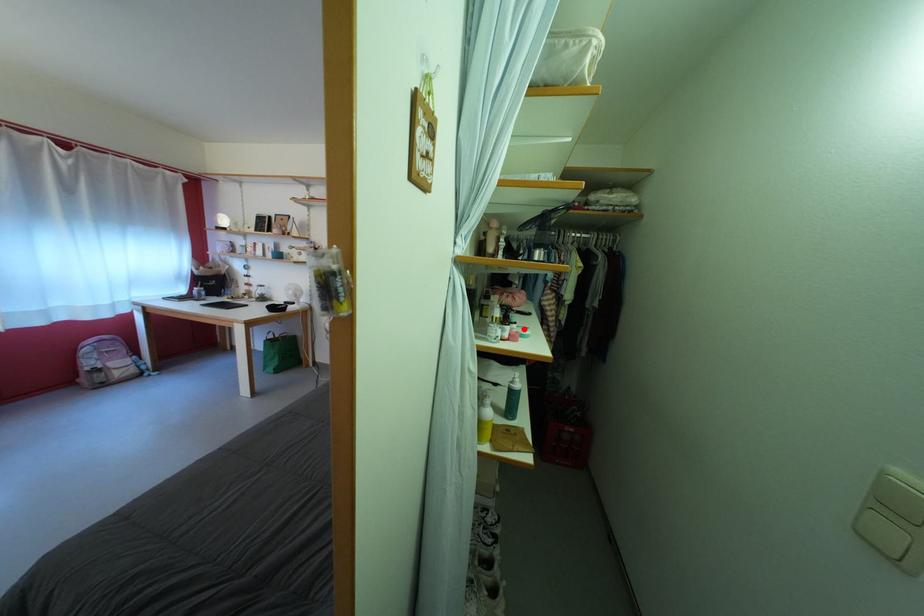
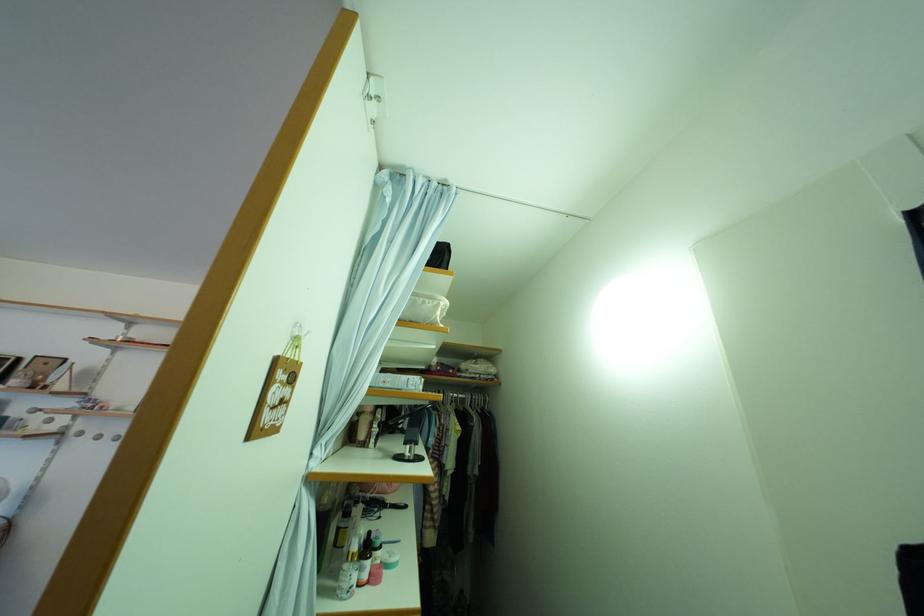
Where in the second image is the point corresponding to the highlighted location from the first image?

(390, 554)